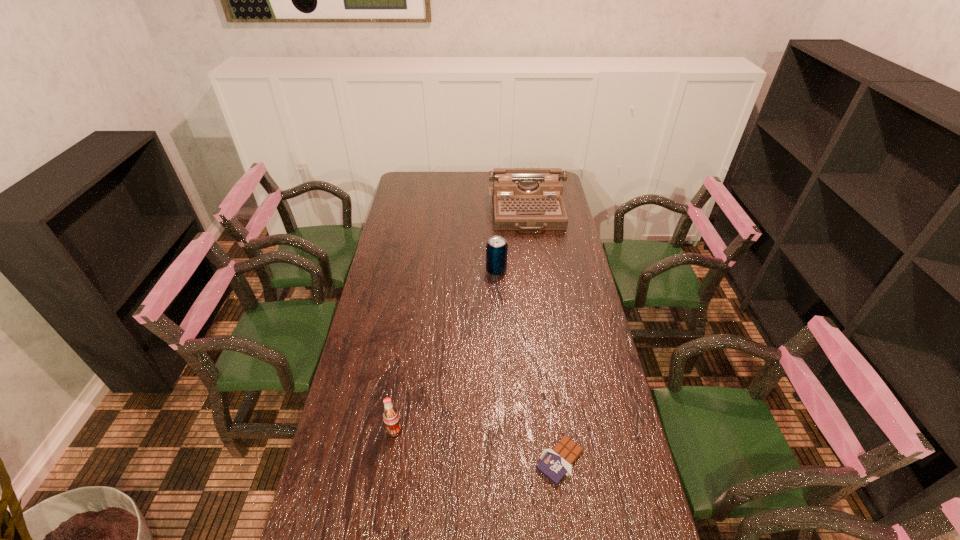
Find the location of a particular element. This screenshot has width=960, height=540. vacant space in between the right soda and the leftmost object is located at coordinates (445, 350).

Where is `free space between the leftmost object and the farther soda`? This screenshot has width=960, height=540. free space between the leftmost object and the farther soda is located at coordinates (445, 350).

You are a GUI agent. You are given a task and a screenshot of the screen. Output one action in this format:
    pyautogui.click(x=<x>, y=<y>)
    Task: Click on the vacant region between the leftmost object and the chocolate bar
    This screenshot has height=540, width=960.
    Given the screenshot: What is the action you would take?
    pyautogui.click(x=477, y=445)

This screenshot has width=960, height=540. Find the location of `free point between the third nearest object and the chocolate bar`. free point between the third nearest object and the chocolate bar is located at coordinates (528, 366).

You are a GUI agent. You are given a task and a screenshot of the screen. Output one action in this format:
    pyautogui.click(x=<x>, y=<y>)
    Task: Click on the unoccupied area between the right soda and the farthest object
    This screenshot has height=540, width=960.
    Given the screenshot: What is the action you would take?
    pyautogui.click(x=512, y=242)

Where is `object identified as the third closest to the tallest object`? The height and width of the screenshot is (540, 960). object identified as the third closest to the tallest object is located at coordinates (555, 463).

Select which object appears as the third closest to the left soda. Please provide its 2D coordinates. Your answer should be formatted as a tuple, i.e. [(x, y)], where the tuple contains the x and y coordinates of a point satisfying the conditions above.

[(523, 198)]

You are a GUI agent. You are given a task and a screenshot of the screen. Output one action in this format:
    pyautogui.click(x=<x>, y=<y>)
    Task: Click on the free region that satisfies the following two spatial constraints: 1. on the front side of the shortest object; 2. on the left side of the left soda
    The width and height of the screenshot is (960, 540).
    Given the screenshot: What is the action you would take?
    pyautogui.click(x=390, y=460)

The image size is (960, 540). What are the coordinates of `vacant region that satisfies the following two spatial constraints: 1. on the back side of the right soda; 2. on the left side of the left soda` in the screenshot? It's located at (420, 271).